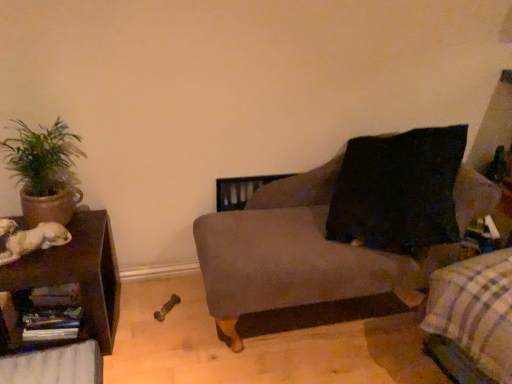
This screenshot has width=512, height=384. What do you see at coordinates (78, 273) in the screenshot? I see `brown wood table at left` at bounding box center [78, 273].

This screenshot has width=512, height=384. Describe the element at coordinates (44, 171) in the screenshot. I see `green leafy plant in clay pot at left` at that location.

Locate an element on the screen. plaid fabric at lower right is located at coordinates (472, 318).

Can you confirm if velvet gray couch at center is taller than plaid fabric at lower right?

Yes, velvet gray couch at center is taller than plaid fabric at lower right.

From the image's perspective, which object appears higher, velvet gray couch at center or plaid fabric at lower right?

velvet gray couch at center.

From a real-world perspective, is velvet gray couch at center beneath plaid fabric at lower right?

No.

Which of these two, velvet gray couch at center or plaid fabric at lower right, is smaller?

Smaller between the two is plaid fabric at lower right.

In order to click on bedding that is on the right side of green leafy plant in clay pot at left in this screenshot , I will do `click(472, 318)`.

Is green leafy plant in clay pot at left not near plaid fabric at lower right?

green leafy plant in clay pot at left is far away from plaid fabric at lower right.

Is green leafy plant in clay pot at left looking in the opposite direction of plaid fabric at lower right?

No, green leafy plant in clay pot at left's orientation is not away from plaid fabric at lower right.

Looking at their sizes, would you say green leafy plant in clay pot at left is wider or thinner than plaid fabric at lower right?

In the image, green leafy plant in clay pot at left appears to be more narrow than plaid fabric at lower right.

This screenshot has width=512, height=384. Identify the location of animal in front of the brown wood table at left. (30, 239).

Is white fur dog at left smaller than brown wood table at left?

Yes, white fur dog at left is smaller than brown wood table at left.

Which of these two, white fur dog at left or brown wood table at left, stands taller?

Standing taller between the two is brown wood table at left.

Does point (14, 258) appear closer or farther from the camera than point (36, 258)?

Point (14, 258) is positioned closer to the camera compared to point (36, 258).

Considering the positions of objects green leafy plant in clay pot at left and white fur dog at left in the image provided, who is in front, green leafy plant in clay pot at left or white fur dog at left?

white fur dog at left.

In the scene shown: Which of these two, green leafy plant in clay pot at left or white fur dog at left, stands shorter?

With less height is white fur dog at left.

Looking at this image, does green leafy plant in clay pot at left contain white fur dog at left?

No, green leafy plant in clay pot at left does not contain white fur dog at left.

From the image's perspective, is green leafy plant in clay pot at left below velvet gray couch at center?

No, from the image's perspective, green leafy plant in clay pot at left is not beneath velvet gray couch at center.

From a real-world perspective, is green leafy plant in clay pot at left positioned over velvet gray couch at center based on gravity?

Yes, from a real-world perspective, green leafy plant in clay pot at left is above velvet gray couch at center.

Is brown wood table at left not close to wooden shelf at lower left?

brown wood table at left is near wooden shelf at lower left, not far away.

Is brown wood table at left in front of or behind wooden shelf at lower left in the image?

brown wood table at left is positioned closer to the viewer than wooden shelf at lower left.

From a real-world perspective, relative to wooden shelf at lower left, is brown wood table at left vertically above or below?

In terms of real-world spatial position, brown wood table at left is above wooden shelf at lower left.

Is brown wood table at left oriented away from wooden shelf at lower left?

Yes, brown wood table at left is positioned with its back facing wooden shelf at lower left.

Is velvet gray couch at center oriented away from green leafy plant in clay pot at left?

velvet gray couch at center is not turned away from green leafy plant in clay pot at left.

Does velvet gray couch at center have a smaller size compared to green leafy plant in clay pot at left?

No.

From a real-world perspective, relative to green leafy plant in clay pot at left, is velvet gray couch at center vertically above or below?

From a real-world perspective, velvet gray couch at center is physically below green leafy plant in clay pot at left.

Looking at this image, considering the sizes of objects velvet gray couch at center and green leafy plant in clay pot at left in the image provided, who is thinner, velvet gray couch at center or green leafy plant in clay pot at left?

green leafy plant in clay pot at left.

I want to click on studio couch that is above the plaid fabric at lower right (from the image's perspective), so click(296, 255).

At what (x,y) coordinates should I click in order to perform the action: click on bedding in front of the green leafy plant in clay pot at left. Please return your answer as a coordinate pair (x, y). Looking at the image, I should click on (472, 318).

From the image, which object appears to be farther from velvet gray couch at center, wooden shelf at lower left or green leafy plant in clay pot at left?

Among the two, wooden shelf at lower left is located further to velvet gray couch at center.

Based on the photo, estimate the real-world distances between objects in this image. Which object is further from plaid fabric at lower right, wooden shelf at lower left or green leafy plant in clay pot at left?

green leafy plant in clay pot at left is positioned further to the anchor plaid fabric at lower right.

Based on their spatial positions, is plaid fabric at lower right or brown wood table at left closer to wooden shelf at lower left?

The object closer to wooden shelf at lower left is brown wood table at left.

Which object lies nearer to the anchor point brown wood table at left, white fur dog at left or green leafy plant in clay pot at left?

Among the two, white fur dog at left is located nearer to brown wood table at left.

When comparing their distances from white fur dog at left, does velvet gray couch at center or plaid fabric at lower right seem further?

plaid fabric at lower right lies further to white fur dog at left than the other object.

Considering their positions, is plaid fabric at lower right positioned further to green leafy plant in clay pot at left than brown wood table at left?

plaid fabric at lower right.

Considering their positions, is white fur dog at left positioned closer to green leafy plant in clay pot at left than wooden shelf at lower left?

white fur dog at left is positioned closer to the anchor green leafy plant in clay pot at left.

Considering their positions, is velvet gray couch at center positioned closer to plaid fabric at lower right than wooden shelf at lower left?

velvet gray couch at center.

Find the location of a particular element. The width and height of the screenshot is (512, 384). studio couch between brown wood table at left and plaid fabric at lower right from left to right is located at coordinates (296, 255).

You are a GUI agent. You are given a task and a screenshot of the screen. Output one action in this format:
    pyautogui.click(x=<x>, y=<y>)
    Task: Click on the houseplant between wooden shelf at lower left and plaid fabric at lower right from left to right
    Image resolution: width=512 pixels, height=384 pixels.
    Given the screenshot: What is the action you would take?
    pyautogui.click(x=44, y=171)

Identify the location of animal between green leafy plant in clay pot at left and brown wood table at left vertically. This screenshot has height=384, width=512. (30, 239).

Locate an element on the screen. houseplant situated between brown wood table at left and velvet gray couch at center from left to right is located at coordinates (44, 171).